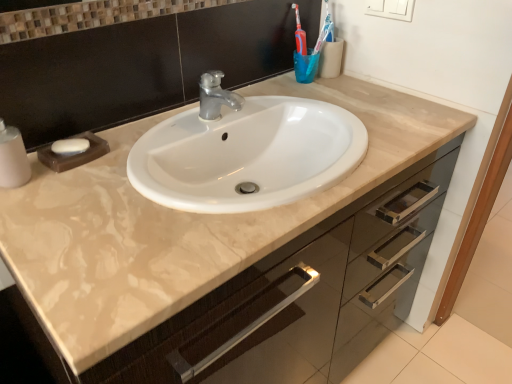
Question: In terms of height, does translucent blue cup at upper right look taller or shorter compared to white matte soap at left?

Choices:
 (A) tall
 (B) short

Answer: (A)

Question: Is translucent blue cup at upper right in front of or behind white matte soap at left in the image?

Choices:
 (A) front
 (B) behind

Answer: (B)

Question: Visually, is translucent blue cup at upper right positioned to the left or to the right of white matte soap at left?

Choices:
 (A) left
 (B) right

Answer: (B)

Question: Considering their positions, is white matte soap at left located in front of or behind translucent blue cup at upper right?

Choices:
 (A) behind
 (B) front

Answer: (B)

Question: From a real-world perspective, relative to translucent blue cup at upper right, is white matte soap at left vertically above or below?

Choices:
 (A) below
 (B) above

Answer: (A)

Question: In terms of width, does white matte soap at left look wider or thinner when compared to translucent blue cup at upper right?

Choices:
 (A) wide
 (B) thin

Answer: (A)

Question: Considering the positions of point (73, 147) and point (309, 61), is point (73, 147) closer or farther from the camera than point (309, 61)?

Choices:
 (A) closer
 (B) farther

Answer: (A)